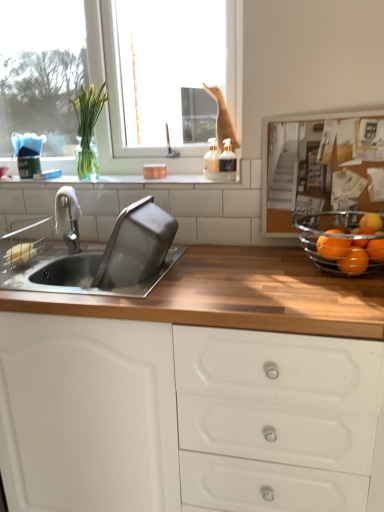
Locate an element on the screen. The image size is (384, 512). free space in front of orange matte/orange at right, which is the 3th orange in right-to-left order is located at coordinates (350, 297).